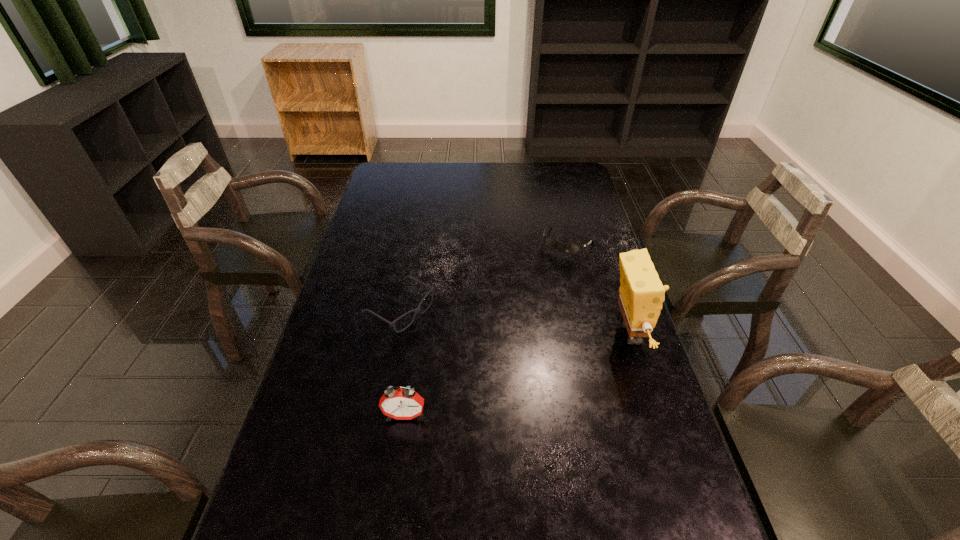
Identify the location of vacant space on the desktop that is between the second tallest object and the tallest object and is positioned on the front-facing side of the spectacles. tap(515, 376).

What are the coordinates of `free spot on the desktop that is between the nearest object and the sponge and is positioned on the front-facing side of the sunglasses` in the screenshot? It's located at (493, 383).